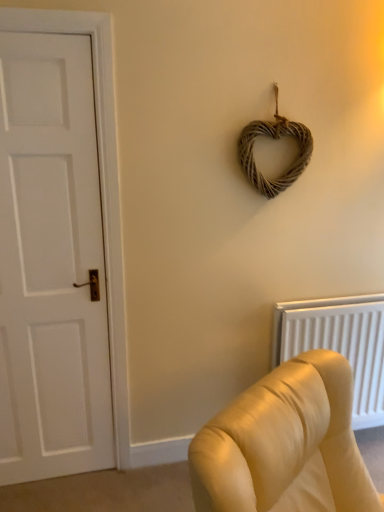
Looking at this image, measure the distance between white matte door at left and camera.

white matte door at left and camera are 5.09 feet apart.

This screenshot has height=512, width=384. What do you see at coordinates (339, 343) in the screenshot?
I see `white textured radiator at lower right` at bounding box center [339, 343].

Identify the location of woven natural heart at upper center. (274, 138).

From the image's perspective, is white textured radiator at lower right under woven natural heart at upper center?

Yes, from the image's perspective, white textured radiator at lower right is below woven natural heart at upper center.

Is white textured radiator at lower right placed right next to woven natural heart at upper center?

They are not placed beside each other.

Do you think white textured radiator at lower right is within woven natural heart at upper center, or outside of it?

white textured radiator at lower right is not enclosed by woven natural heart at upper center.

Is white textured radiator at lower right facing away from woven natural heart at upper center?

white textured radiator at lower right does not have its back to woven natural heart at upper center.

Does white textured radiator at lower right come in front of white matte door at left?

No, it is not.

From the image's perspective, which is below, white textured radiator at lower right or white matte door at left?

From the image's view, white textured radiator at lower right is below.

Is white textured radiator at lower right taller or shorter than white matte door at left?

In the image, white textured radiator at lower right appears to be shorter than white matte door at left.

In terms of width, does white textured radiator at lower right look wider or thinner when compared to white matte door at left?

Clearly, white textured radiator at lower right has more width compared to white matte door at left.

Which is in front, white matte door at left or white textured radiator at lower right?

white matte door at left is more forward.

Is white matte door at left wider or thinner than white textured radiator at lower right?

white matte door at left is thinner than white textured radiator at lower right.

Does point (63, 293) come farther from viewer compared to point (294, 338)?

No, it is in front of (294, 338).

From a real-world perspective, between white matte door at left and white textured radiator at lower right, who is vertically higher?

From a 3D spatial view, white matte door at left is above.

Is white matte door at left turned away from woven natural heart at upper center?

No, white matte door at left's orientation is not away from woven natural heart at upper center.

Considering the relative positions of white matte door at left and woven natural heart at upper center in the image provided, is white matte door at left to the right of woven natural heart at upper center from the viewer's perspective?

No.

Is white matte door at left far from woven natural heart at upper center?

No, white matte door at left is in close proximity to woven natural heart at upper center.

Which of these two, white matte door at left or woven natural heart at upper center, is wider?

Wider between the two is white matte door at left.

Between woven natural heart at upper center and white matte door at left, which one has smaller width?

Thinner between the two is woven natural heart at upper center.

From a real-world perspective, is woven natural heart at upper center physically above white matte door at left?

Yes, from a real-world perspective, woven natural heart at upper center is on top of white matte door at left.

From the image's perspective, between woven natural heart at upper center and white matte door at left, which one is located above?

woven natural heart at upper center.

Considering the positions of point (292, 167) and point (369, 407), is point (292, 167) closer or farther from the camera than point (369, 407)?

Point (292, 167) is closer to the camera than point (369, 407).

From a real-world perspective, is woven natural heart at upper center positioned under white textured radiator at lower right based on gravity?

No, from a real-world perspective, woven natural heart at upper center is not below white textured radiator at lower right.

What's the angular difference between woven natural heart at upper center and white textured radiator at lower right's facing directions?

woven natural heart at upper center and white textured radiator at lower right are facing 1.1 degrees away from each other.

Is the surface of woven natural heart at upper center in direct contact with white textured radiator at lower right?

No, woven natural heart at upper center is not beside white textured radiator at lower right.

This screenshot has width=384, height=512. I want to click on radiator below the woven natural heart at upper center (from the image's perspective), so click(x=339, y=343).

Where is `door positioned vertically above the white textured radiator at lower right (from a real-world perspective)`? door positioned vertically above the white textured radiator at lower right (from a real-world perspective) is located at coordinates (51, 264).

When comparing their distances from white textured radiator at lower right, does white matte door at left or woven natural heart at upper center seem further?

white matte door at left lies further to white textured radiator at lower right than the other object.

In the scene shown: Which object lies nearer to the anchor point woven natural heart at upper center, white textured radiator at lower right or white matte door at left?

white textured radiator at lower right is positioned closer to the anchor woven natural heart at upper center.

When comparing their distances from white textured radiator at lower right, does woven natural heart at upper center or white matte door at left seem further?

white matte door at left.

Considering their positions, is woven natural heart at upper center positioned further to white matte door at left than white textured radiator at lower right?

white textured radiator at lower right lies further to white matte door at left than the other object.

Estimate the real-world distances between objects in this image. Which object is further from woven natural heart at upper center, white matte door at left or white textured radiator at lower right?

white matte door at left lies further to woven natural heart at upper center than the other object.

Looking at the image, which one is located closer to white matte door at left, white textured radiator at lower right or woven natural heart at upper center?

woven natural heart at upper center.

Locate an element on the screen. The height and width of the screenshot is (512, 384). rope situated between white matte door at left and white textured radiator at lower right from left to right is located at coordinates (274, 138).